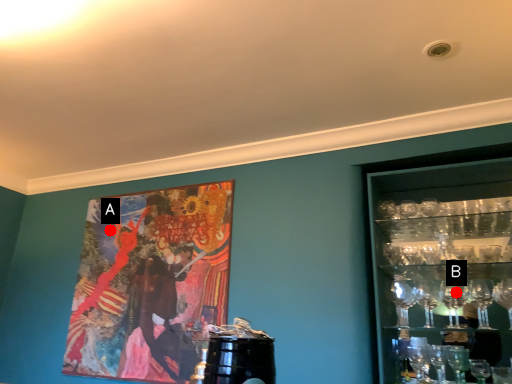
Question: Two points are circled on the image, labeled by A and B beside each circle. Which point is farther from the camera taking this photo?

Choices:
 (A) A is further
 (B) B is further

Answer: (A)